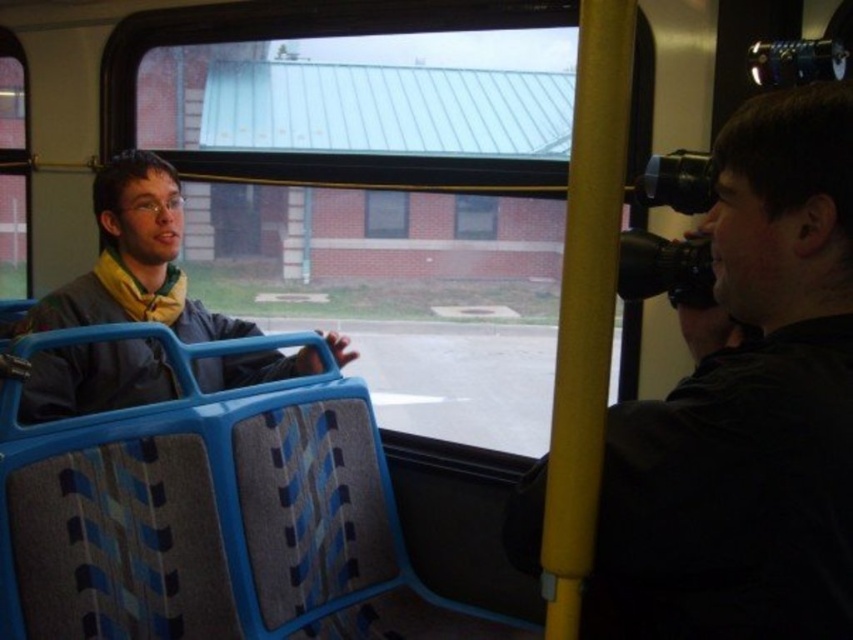
You are a photographer who needs to pass the black rubber camera at right to the other person sitting next to you on the bus. Can you hand it over without moving your seat?

The two individuals are 28.42 inches apart, so yes, you can hand the black rubber camera at right to the other person without moving your seat as the distance is manageable for reaching across.

You are a photographer trying to decide whether to place your black rubber camera at right on top of the matte gray jacket at left. Based on their sizes, will the camera fit without hanging over the edges?

The black rubber camera at right is not as tall as matte gray jacket at left, so it should fit without hanging over the edges.

You are a photographer needing to adjust your equipment. You have the black rubber camera at right and the matte gray jacket at left in your view. Which object is nearer to you?

The black rubber camera at right is closer to the viewer than the matte gray jacket at left, so the camera is nearer.